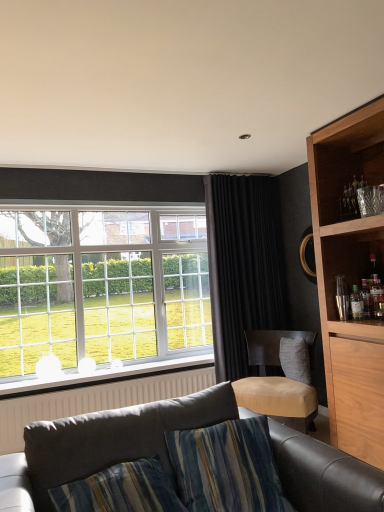
Question: From the image's perspective, is black velvet curtain at center located above or below white textured radiator at lower left?

Choices:
 (A) below
 (B) above

Answer: (B)

Question: Would you say black velvet curtain at center is to the left or to the right of white textured radiator at lower left in the picture?

Choices:
 (A) left
 (B) right

Answer: (B)

Question: Estimate the real-world distances between objects in this image. Which object is closer to the black velvet curtain at center?

Choices:
 (A) translucent glass bottle at right, the 2th bottle from the right
 (B) translucent glass bottles at right, the first bottle viewed from the right
 (C) dark gray fabric couch at lower center
 (D) white textured radiator at lower left
 (E) dark gray fabric armchair at right

Answer: (E)

Question: Which is nearer to the translucent glass bottle at right, the 2th bottle from the right?

Choices:
 (A) dark gray fabric armchair at right
 (B) dark gray fabric couch at lower center
 (C) leather cushioned chair at center
 (D) black velvet curtain at center
 (E) translucent glass bottles at right, which appears as the 2th bottle when viewed from the left

Answer: (E)